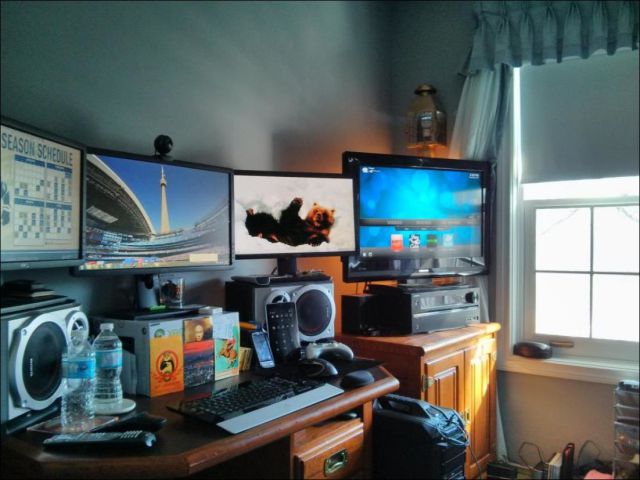
Where is `windowsill`? This screenshot has width=640, height=480. windowsill is located at coordinates (576, 361).